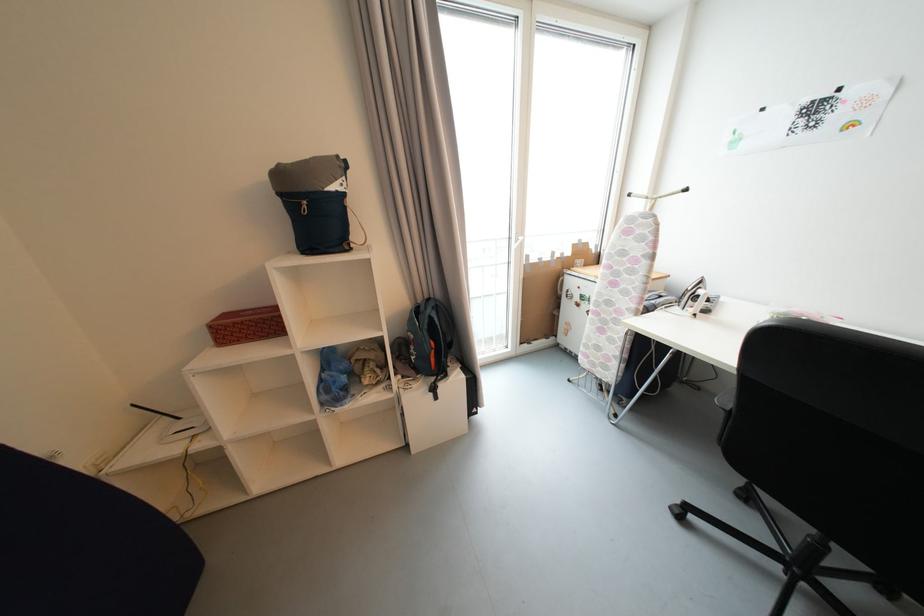
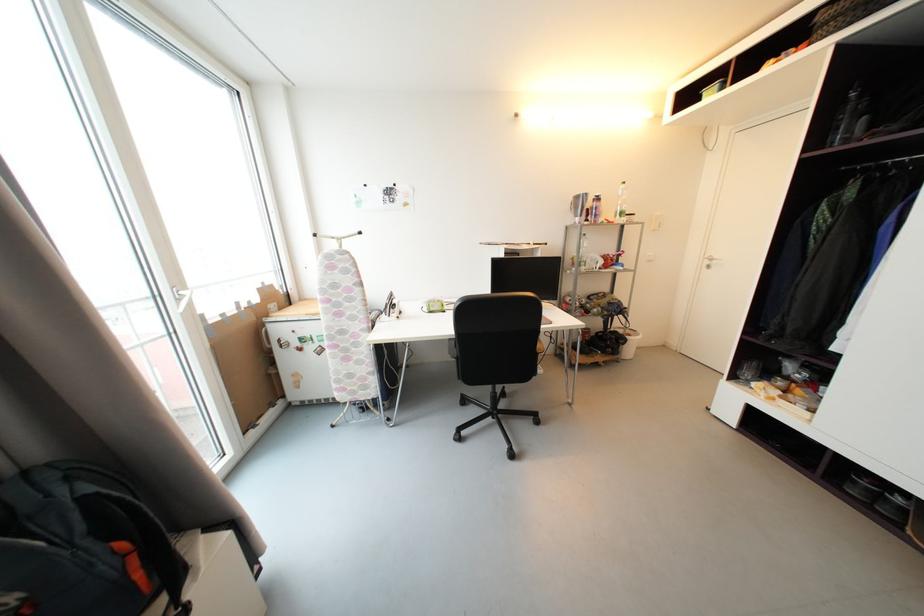
Question: Based on the continuous images, in which direction is the camera rotating? Reply with the corresponding letter.

Choices:
 (A) Left
 (B) Right
 (C) Up
 (D) Down

Answer: (B)